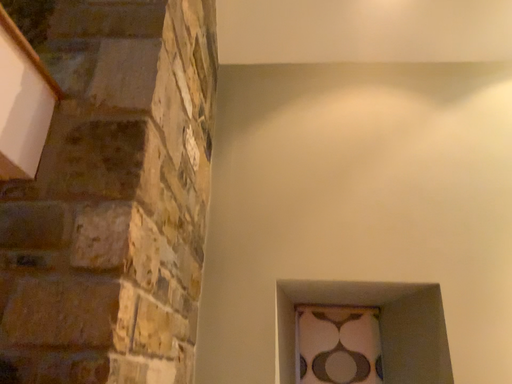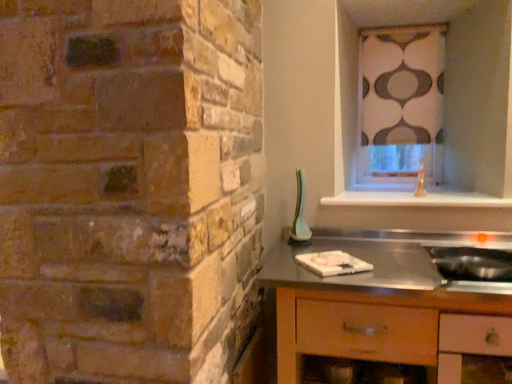
Question: How did the camera likely rotate when shooting the video?

Choices:
 (A) rotated upward
 (B) rotated downward

Answer: (B)